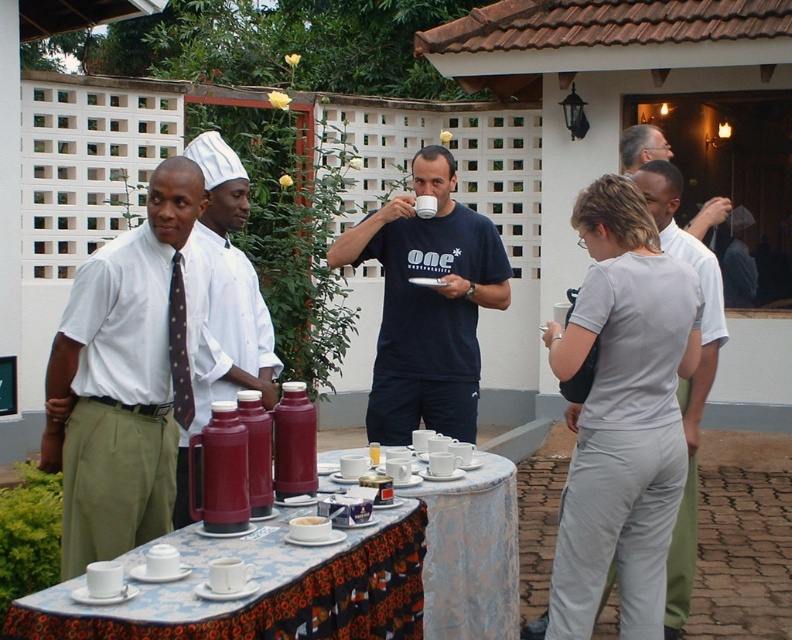
Can you confirm if matte blue t-shirt at center is wider than white matte sugar at table center?

Yes.

Can you confirm if matte blue t-shirt at center is taller than white matte sugar at table center?

Yes, matte blue t-shirt at center is taller than white matte sugar at table center.

Which is in front, point (452, 285) or point (322, 516)?

Point (322, 516) is in front.

Identify the location of matte blue t-shirt at center. Image resolution: width=792 pixels, height=640 pixels. (427, 305).

Based on the photo, who is shorter, matte white shirt at left or matte blue t-shirt at center?

Standing shorter between the two is matte white shirt at left.

Which of these two, matte white shirt at left or matte blue t-shirt at center, stands taller?

matte blue t-shirt at center is taller.

Does point (122, 536) come in front of point (440, 368)?

Yes, it is in front of point (440, 368).

Where is `matte white shirt at left`? matte white shirt at left is located at coordinates (126, 376).

This screenshot has height=640, width=792. Describe the element at coordinates (278, 600) in the screenshot. I see `blue printed fabric at lower center` at that location.

Is point (366, 627) farther from viewer compared to point (684, 554)?

No, it is in front of (684, 554).

The width and height of the screenshot is (792, 640). What are the coordinates of `blue printed fabric at lower center` in the screenshot? It's located at (278, 600).

Identify the location of blue printed fabric at lower center. The width and height of the screenshot is (792, 640). (278, 600).